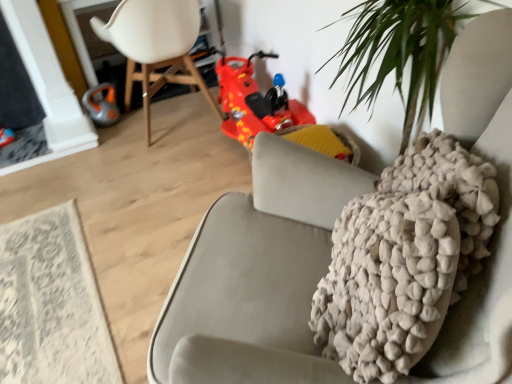
Locate an element on the screen. The width and height of the screenshot is (512, 384). free area in between orange rubber vacuum cleaner at left and shiny red plastic toy car at center is located at coordinates click(185, 135).